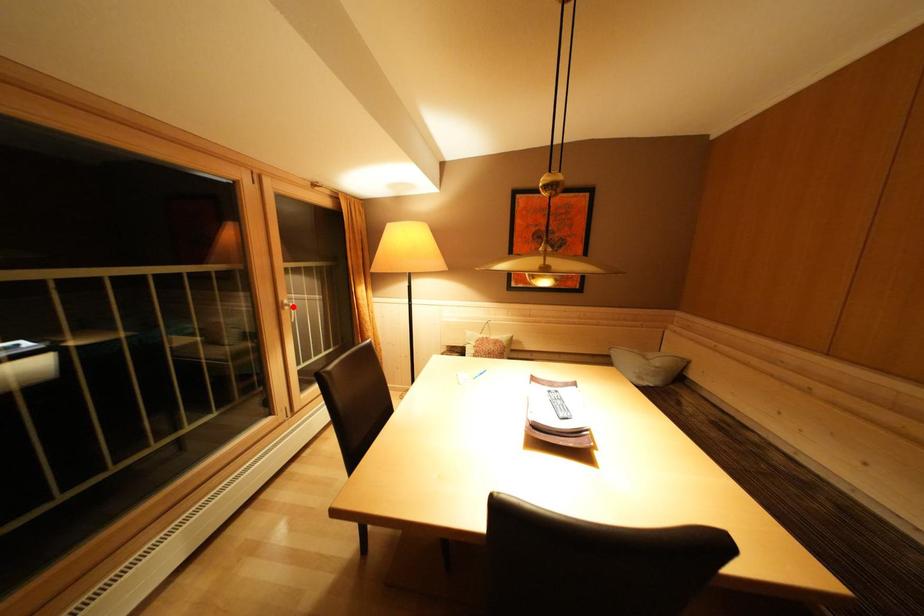
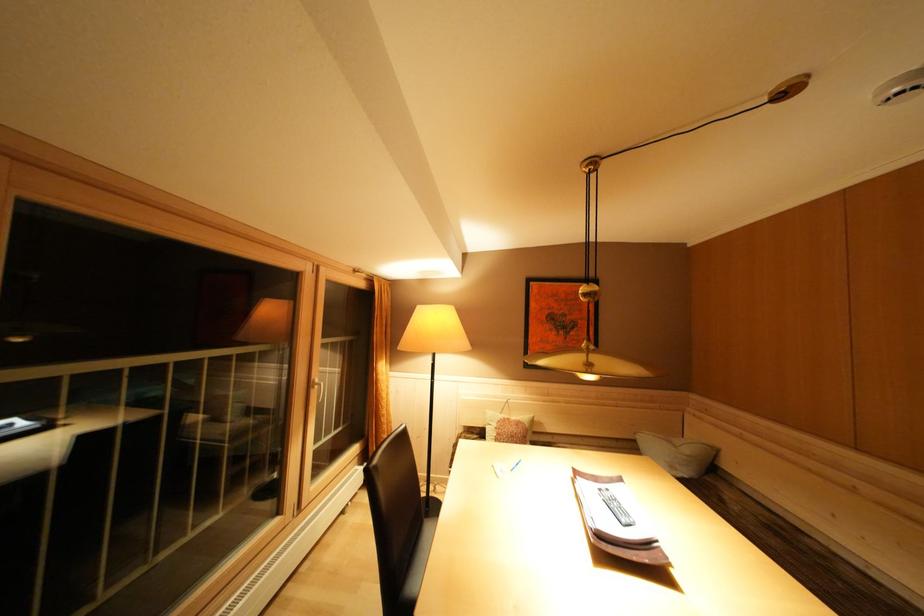
Locate, in the second image, the point that corresponds to the highlighted location in the first image.

(323, 386)